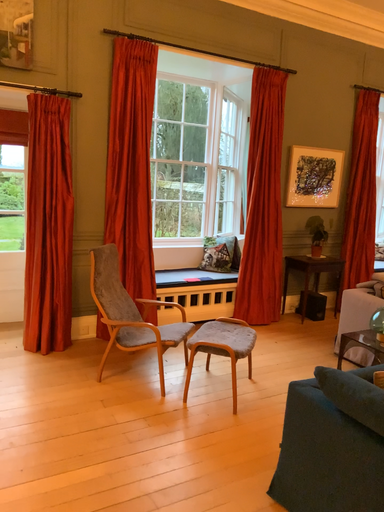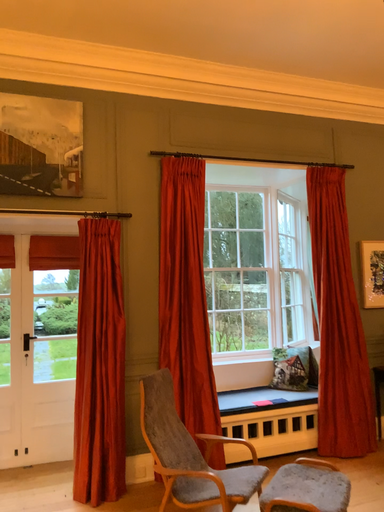
Question: Which way did the camera rotate in the video?

Choices:
 (A) rotated right
 (B) rotated left

Answer: (B)